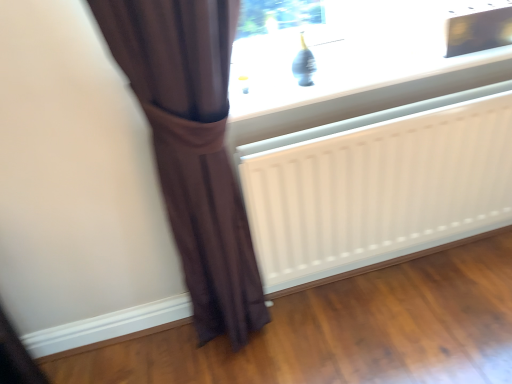
Question: Can brown fabric curtain at left be found inside matte glass window at upper center?

Choices:
 (A) no
 (B) yes

Answer: (A)

Question: Is matte glass window at upper center oriented away from brown fabric curtain at left?

Choices:
 (A) yes
 (B) no

Answer: (B)

Question: Considering the relative positions of matte glass window at upper center and brown fabric curtain at left in the image provided, is matte glass window at upper center behind brown fabric curtain at left?

Choices:
 (A) no
 (B) yes

Answer: (B)

Question: From the image's perspective, does matte glass window at upper center appear higher than brown fabric curtain at left?

Choices:
 (A) yes
 (B) no

Answer: (A)

Question: Could you tell me if matte glass window at upper center is facing brown fabric curtain at left?

Choices:
 (A) no
 (B) yes

Answer: (A)

Question: Relative to matte glass window at upper center, is brown fabric curtain at left in front or behind?

Choices:
 (A) behind
 (B) front

Answer: (B)

Question: Is brown fabric curtain at left to the left or to the right of matte glass window at upper center in the image?

Choices:
 (A) right
 (B) left

Answer: (B)

Question: From a real-world perspective, is brown fabric curtain at left positioned above or below matte glass window at upper center?

Choices:
 (A) above
 (B) below

Answer: (B)

Question: Would you say brown fabric curtain at left is inside or outside matte glass window at upper center?

Choices:
 (A) inside
 (B) outside

Answer: (B)

Question: From the image's perspective, is white matte radiator at lower center above or below brown fabric curtain at left?

Choices:
 (A) above
 (B) below

Answer: (A)

Question: From a real-world perspective, is white matte radiator at lower center above or below brown fabric curtain at left?

Choices:
 (A) below
 (B) above

Answer: (A)

Question: Considering the positions of white matte radiator at lower center and brown fabric curtain at left in the image, is white matte radiator at lower center taller or shorter than brown fabric curtain at left?

Choices:
 (A) short
 (B) tall

Answer: (A)

Question: Does point (370, 231) appear closer or farther from the camera than point (207, 102)?

Choices:
 (A) closer
 (B) farther

Answer: (B)

Question: From the image's perspective, is brown fabric curtain at left located above or below white matte radiator at lower center?

Choices:
 (A) below
 (B) above

Answer: (A)

Question: From their relative heights in the image, would you say brown fabric curtain at left is taller or shorter than white matte radiator at lower center?

Choices:
 (A) tall
 (B) short

Answer: (A)